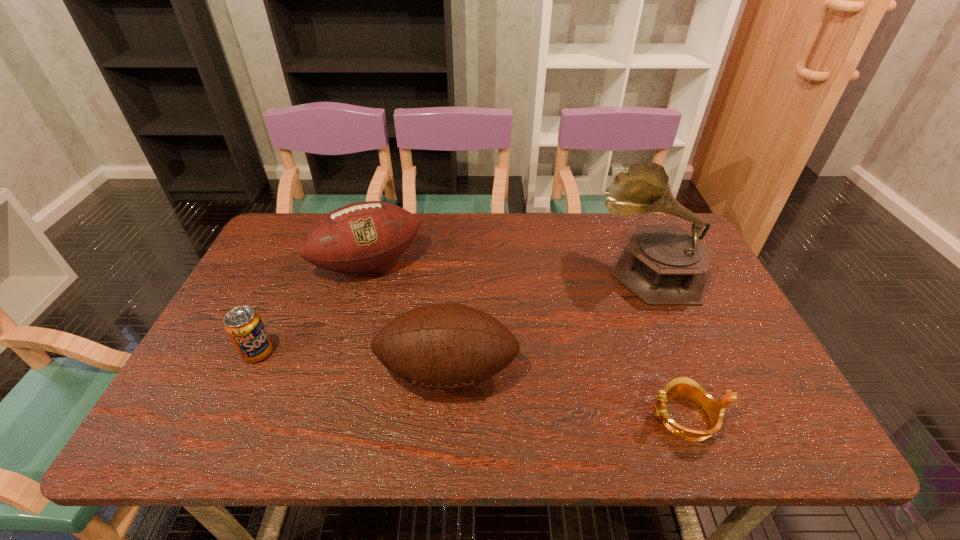
Where is `the tallest object`? Image resolution: width=960 pixels, height=540 pixels. the tallest object is located at coordinates (663, 265).

This screenshot has height=540, width=960. I want to click on the farther football, so click(x=363, y=236).

Where is `the nearer football`? the nearer football is located at coordinates (440, 346).

Where is `soda can`? The image size is (960, 540). soda can is located at coordinates (244, 327).

Where is `the leftmost object`? This screenshot has height=540, width=960. the leftmost object is located at coordinates point(244,327).

The width and height of the screenshot is (960, 540). Find the location of `tiara`. tiara is located at coordinates (681, 387).

At what (x,y) coordinates should I click in order to perform the action: click on vacant position located on the horn direction of the phonograph record. Please return your answer as a coordinate pair (x, y). The width and height of the screenshot is (960, 540). Looking at the image, I should click on (579, 269).

At what (x,y) coordinates should I click in order to perform the action: click on vacant space located on the horn direction of the phonograph record. Please return your answer as a coordinate pair (x, y). Looking at the image, I should click on (539, 269).

The width and height of the screenshot is (960, 540). What are the coordinates of `vacant position located on the horn direction of the phonograph record` in the screenshot? It's located at (545, 269).

At what (x,y) coordinates should I click in order to perform the action: click on vacant space situated on the right of the farther football. Please return your answer as a coordinate pair (x, y). This screenshot has width=960, height=540. Looking at the image, I should click on (525, 264).